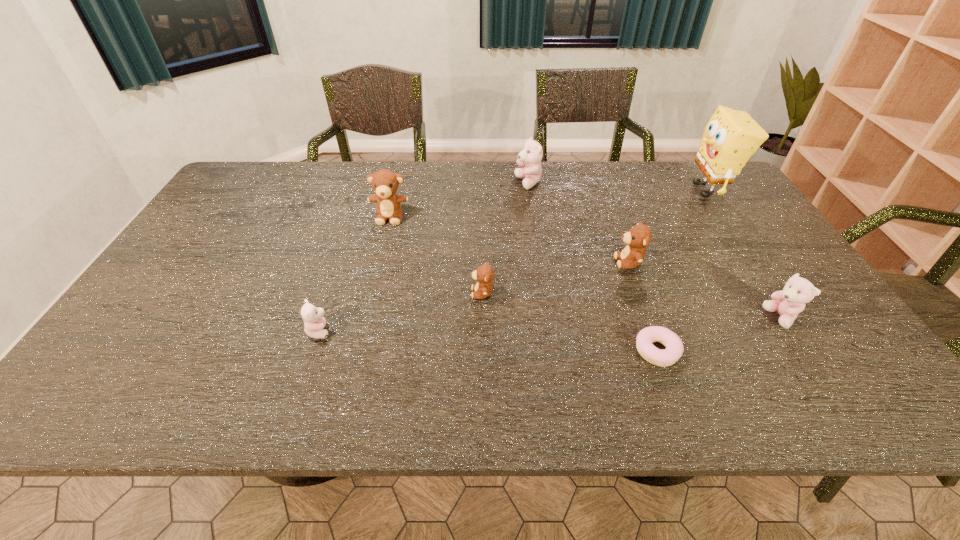
Locate an element on the screen. vacant space situated on the face of the smallest brown teddy bear is located at coordinates 328,293.

I want to click on free space located 0.220m on the face of the smallest brown teddy bear, so click(384, 293).

What are the coordinates of `vacant space situated 0.070m at the face of the leftmost teddy bear` in the screenshot? It's located at coord(362,331).

I want to click on vacant space situated on the right of the doughnut, so click(729, 351).

This screenshot has width=960, height=540. In order to click on sponge at the far edge in this screenshot , I will do `click(731, 137)`.

In order to click on teddy bear at the far edge in this screenshot , I will do `click(531, 155)`.

The image size is (960, 540). In order to click on sponge located at the right edge in this screenshot , I will do `click(731, 137)`.

Where is `teddy bear located at the right edge`? The height and width of the screenshot is (540, 960). teddy bear located at the right edge is located at coordinates (788, 303).

Where is `object that is at the far right corner`? object that is at the far right corner is located at coordinates (731, 137).

Where is `blank space at the far edge`? The height and width of the screenshot is (540, 960). blank space at the far edge is located at coordinates (410, 165).